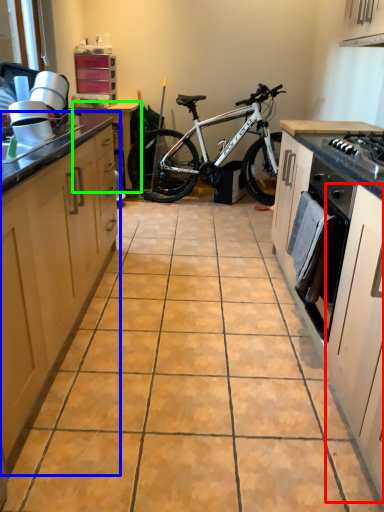
Question: Based on their relative distances, which object is farther from cabinetry (highlighted by a red box)? Choose from cabinetry (highlighted by a blue box) and table (highlighted by a green box).

Choices:
 (A) cabinetry
 (B) table

Answer: (B)